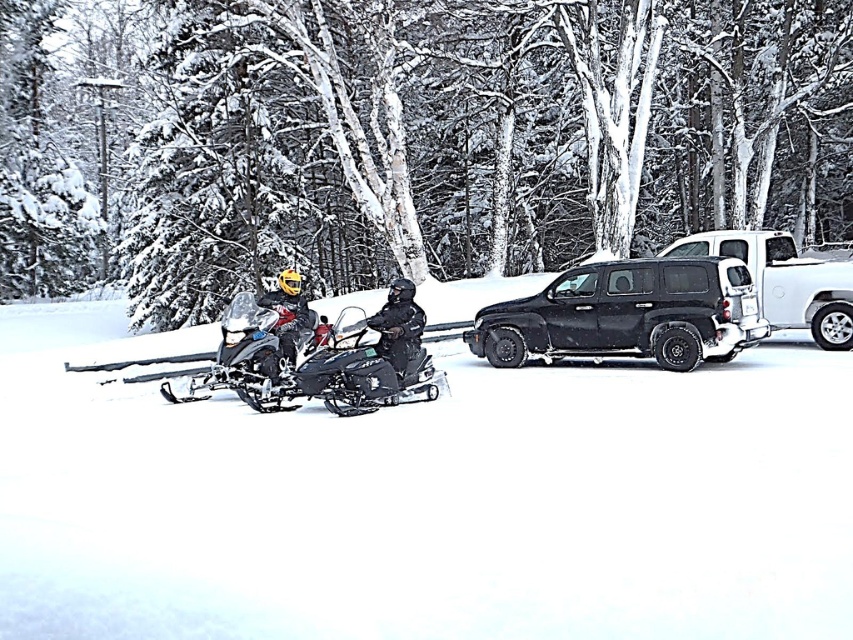
Based on the photo, you are a photographer trying to capture a clear shot of the shiny black snowmobile at center and the white glossy trailer truck at center right. Since the snowmobile is partially hidden, which object should you move closer to in order to get a better view of both?

You should move closer to the white glossy trailer truck at center right because the shiny black snowmobile at center is behind it, so moving towards the truck would allow you to see both objects more clearly by reducing the obstruction.